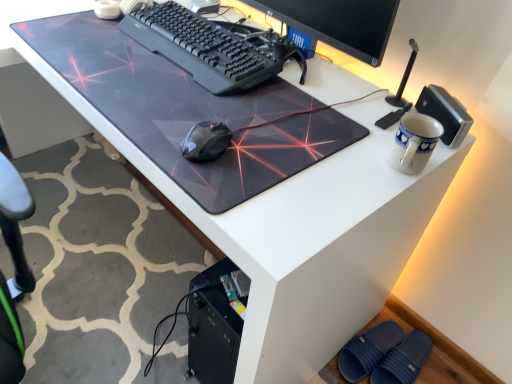
The width and height of the screenshot is (512, 384). What are the coordinates of `free space to the back side of blue ceramic mug at upper right` in the screenshot? It's located at (360, 114).